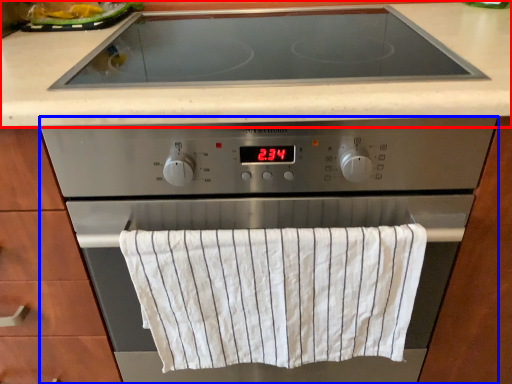
Question: Which object appears closest to the camera in this image, countertop (highlighted by a red box) or home appliance (highlighted by a blue box)?

Choices:
 (A) countertop
 (B) home appliance

Answer: (B)